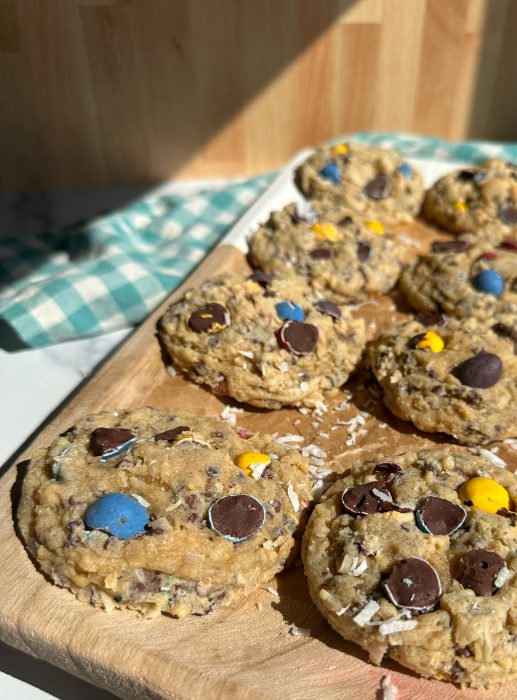
I want to click on brown side of tray, so click(129, 384).